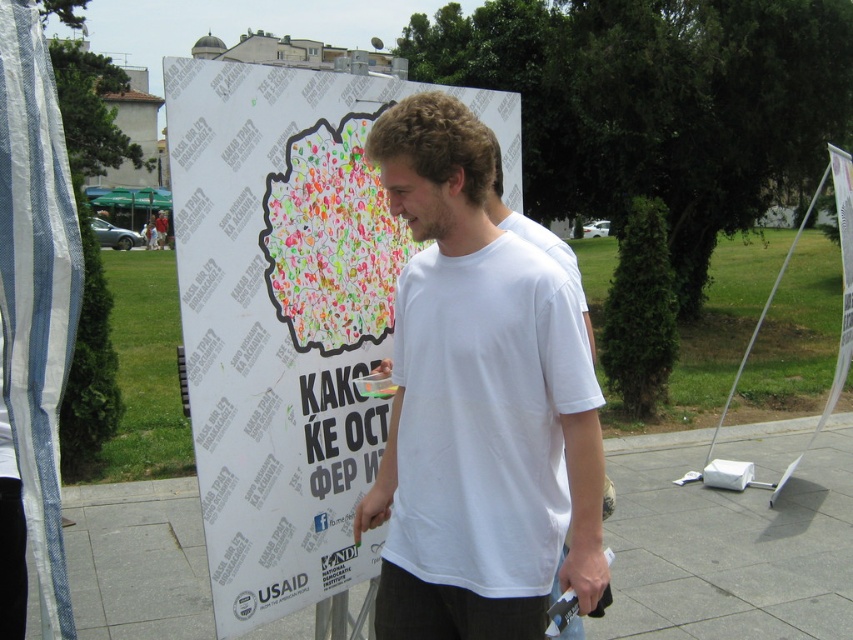
Between white paper poster at center and white cotton t-shirt at center, which one has more height?

white paper poster at center

Which is more to the left, white paper poster at center or white cotton t-shirt at center?

white paper poster at center

The image size is (853, 640). Find the location of `white paper poster at center`. white paper poster at center is located at coordinates (287, 316).

Does point (328, 237) lie in front of point (645, 573)?

Yes, point (328, 237) is in front of point (645, 573).

Is white paper poster at center bigger than gray concrete pavement at center?

Indeed, white paper poster at center has a larger size compared to gray concrete pavement at center.

Is point (292, 173) closer to viewer compared to point (795, 557)?

Yes, point (292, 173) is in front of point (795, 557).

Identify the location of white paper poster at center. (287, 316).

Can you confirm if white cotton t-shirt at center is bigger than gray concrete pavement at center?

Correct, white cotton t-shirt at center is larger in size than gray concrete pavement at center.

Is point (474, 328) positioned behind point (840, 580)?

No, it is in front of (840, 580).

Is point (384, 470) positioned in front of point (693, 556)?

Yes.

Locate an element on the screen. The width and height of the screenshot is (853, 640). white cotton t-shirt at center is located at coordinates (477, 403).